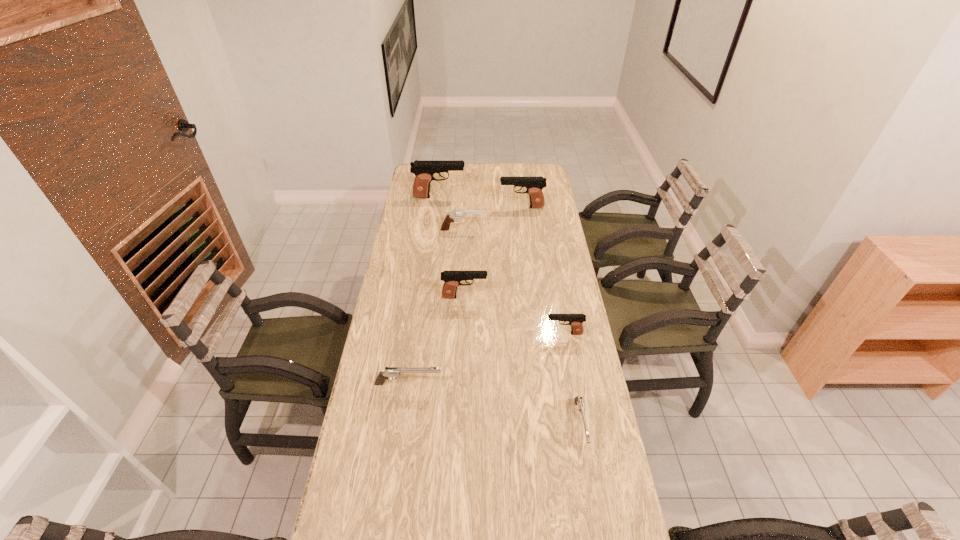
Locate an element on the screen. free region located at the barrel of the smallest black pistol is located at coordinates (494, 334).

At what (x,y) coordinates should I click in order to perform the action: click on free space located 0.290m at the barrel of the smallest black pistol. Please return your answer as a coordinate pair (x, y). This screenshot has height=540, width=960. Looking at the image, I should click on (467, 334).

Where is `vacant space located on the front-facing side of the second nearest object`? The height and width of the screenshot is (540, 960). vacant space located on the front-facing side of the second nearest object is located at coordinates [545, 384].

Where is `free space located 0.090m on the front-facing side of the right silver pistol`? free space located 0.090m on the front-facing side of the right silver pistol is located at coordinates (591, 484).

I want to click on vacant point at the far edge, so click(453, 182).

Locate an element on the screen. Image resolution: width=960 pixels, height=540 pixels. vacant space at the left edge of the desktop is located at coordinates click(x=422, y=270).

I want to click on free location at the far left corner, so click(436, 184).

Locate an element on the screen. This screenshot has height=540, width=960. free space between the nearest black pistol and the farthest black pistol is located at coordinates (502, 265).

Identify the location of vacant point located between the left silver pistol and the fifth nearest object. click(435, 307).

Locate an element on the screen. Image resolution: width=960 pixels, height=540 pixels. empty space between the third biggest black pistol and the tallest pistol is located at coordinates (452, 247).